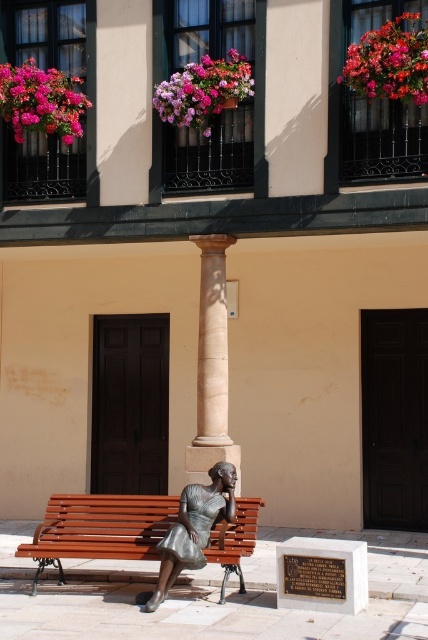
Between beige marble column at center and pink fabric flower at upper right, which one appears on the left side from the viewer's perspective?

From the viewer's perspective, beige marble column at center appears more on the left side.

Is point (211, 308) closer to viewer compared to point (409, 32)?

No, it is not.

Find the location of a particular element. beige marble column at center is located at coordinates (211, 364).

Is the position of pink fabric flower at upper right less distant than that of pink fabric flowers at upper left?

That is True.

Is pink fabric flower at upper right to the right of pink fabric flowers at upper left from the viewer's perspective?

Yes, pink fabric flower at upper right is to the right of pink fabric flowers at upper left.

The image size is (428, 640). In order to click on pink fabric flower at upper right in this screenshot , I will do `click(389, 61)`.

Consider the image. Can you confirm if pink fabric flowers at upper left is positioned to the right of bronze statue at center?

Incorrect, pink fabric flowers at upper left is not on the right side of bronze statue at center.

Does point (39, 97) lie in front of point (172, 561)?

No, it is behind (172, 561).

Where is `pink fabric flowers at upper left`? The image size is (428, 640). pink fabric flowers at upper left is located at coordinates (41, 100).